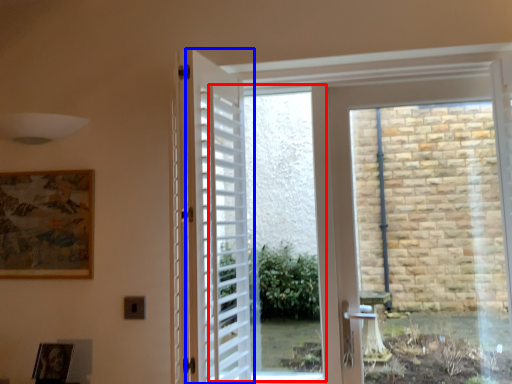
Question: Which of the following is the farthest to the observer, window screen (highlighted by a red box) or door (highlighted by a blue box)?

Choices:
 (A) window screen
 (B) door

Answer: (A)